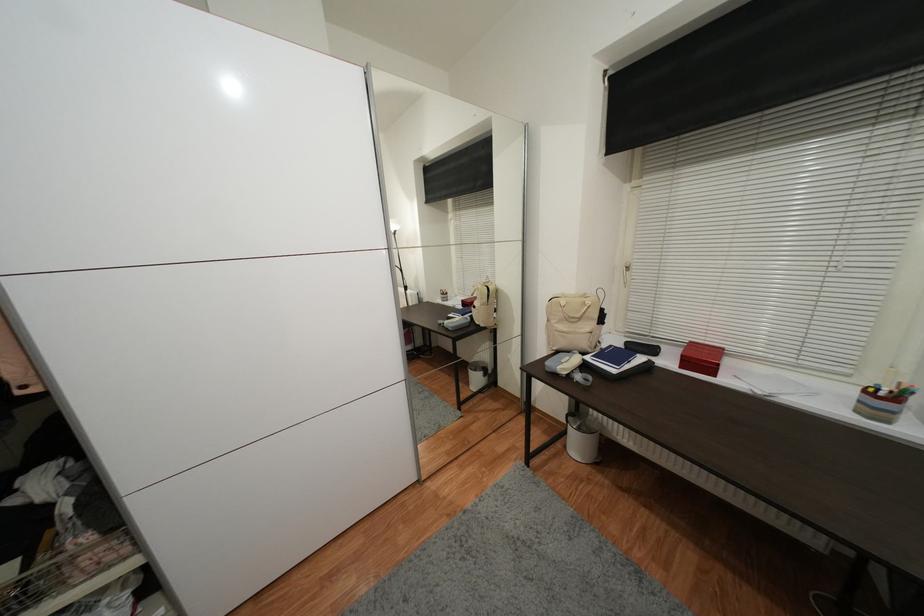
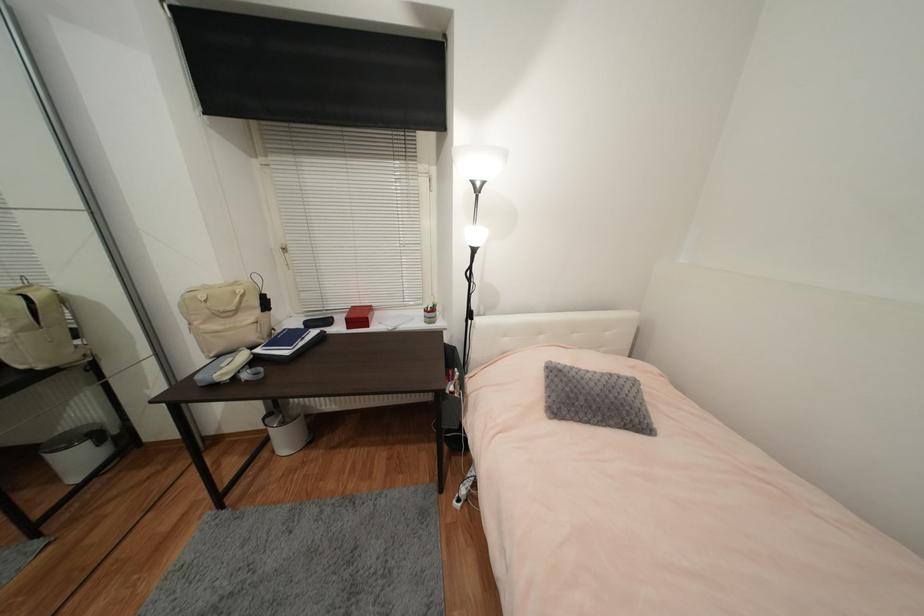
In the second image, find the point that corresponds to point 871,392 in the first image.

(430, 312)